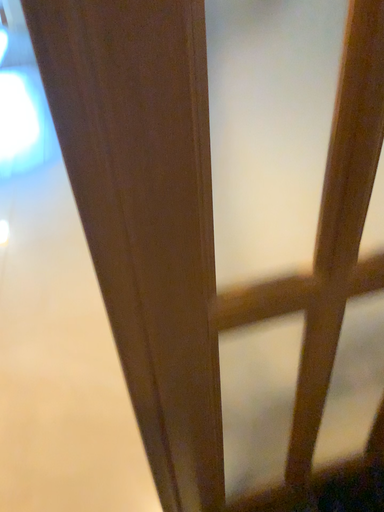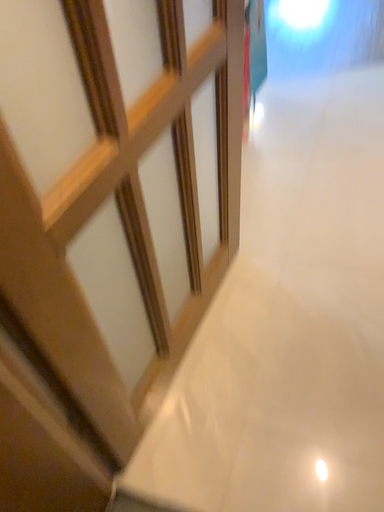
Question: Which way did the camera rotate in the video?

Choices:
 (A) rotated right
 (B) rotated left

Answer: (B)